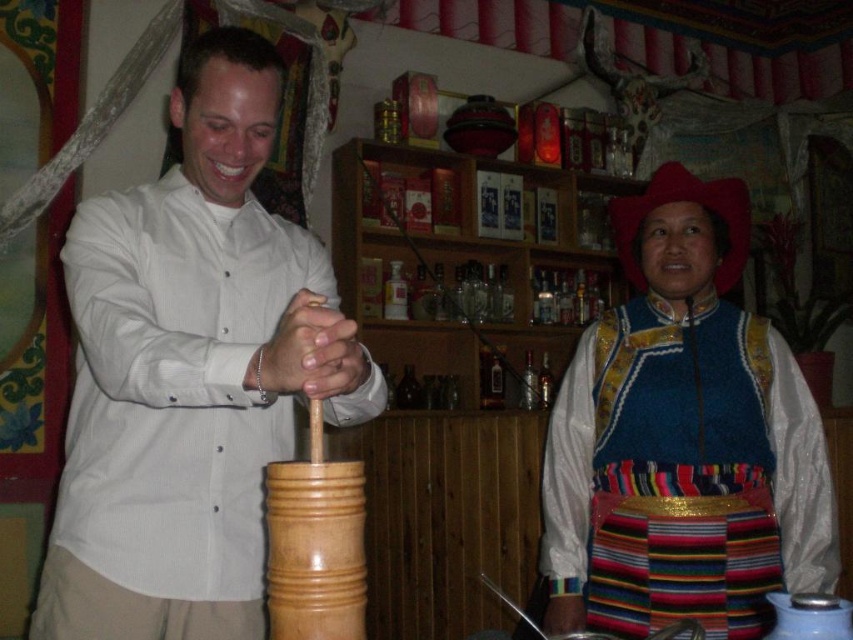
You are a photographer standing at the camera position. You want to take a photo of the white matte shirt at center. Can you reach it with your hand to adjust it before taking the shot?

The white matte shirt at center and camera are 29.02 inches apart, so yes, you can reach the white matte shirt at center with your hand to adjust it before taking the shot since it is within arm reach.

You are a photographer standing in front of the two people in the image. You want to take a photo that includes both the white matte shirt at center and the blue woven vest at center without any part of them being cut off. What is the minimum distance you should be from them to ensure both are fully in frame?

Result: The distance between the white matte shirt at center and the blue woven vest at center is 81.85 centimeters. To capture both in the frame without cropping, the photographer should position themselves at least 81.85 centimeters away from the closest subject to ensure the entire span between them fits within the camera frame.

You are an anthropologist observing a cultural ceremony. You notice two garments in the scene. Which garment is positioned higher on the person wearing them? The white matte shirt at center and the blue woven vest at center are both visible. Please identify which one is higher.

The white matte shirt at center is above the blue woven vest at center, so the white matte shirt at center is positioned higher.